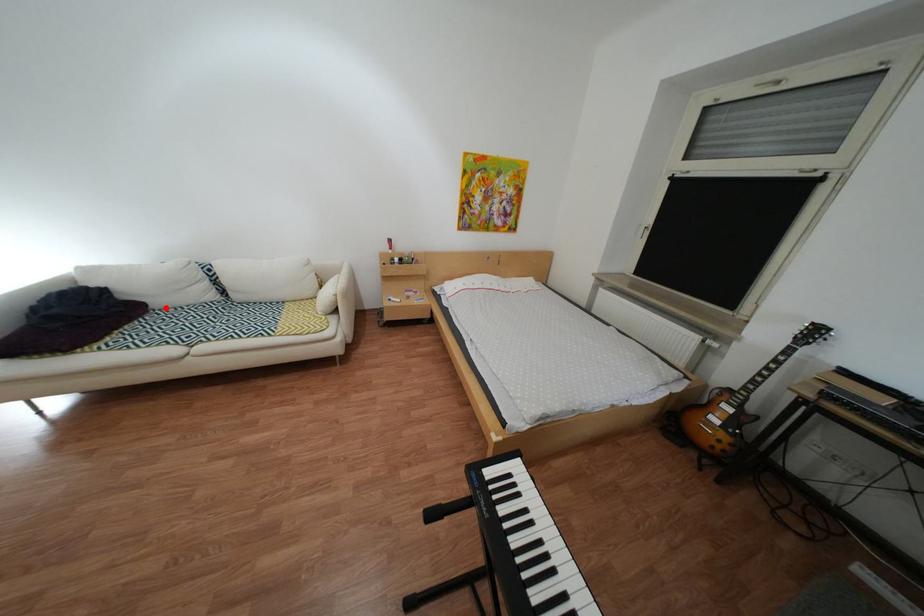
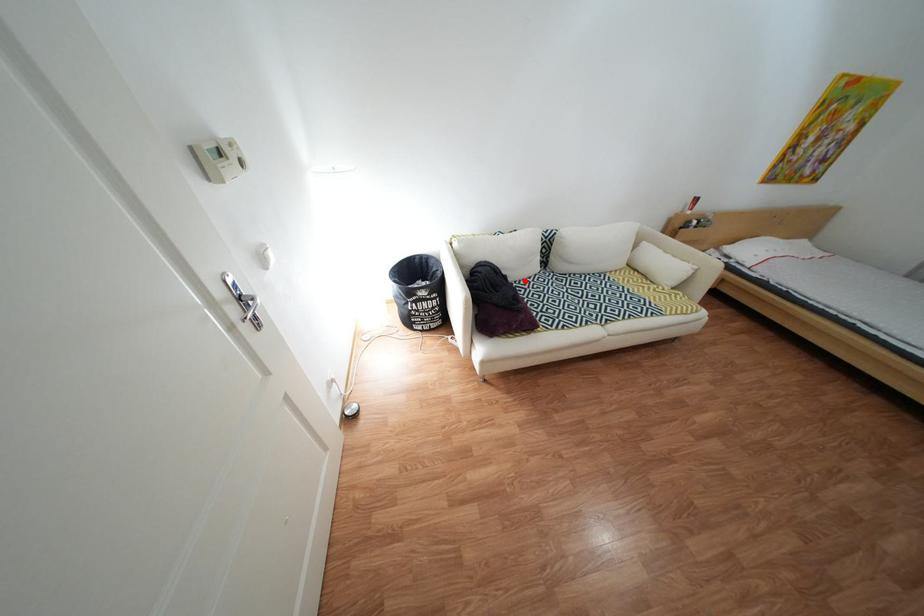
I am providing you with two images of the same scene from different viewpoints. A red point is marked on the first image and another point is marked on the second image. Are the points marked in image1 and image2 representing the same 3D position?

Yes